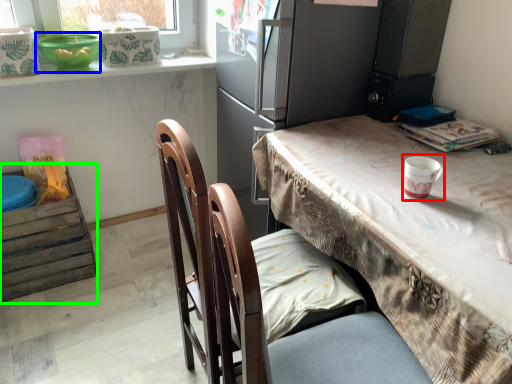
Question: Estimate the real-world distances between objects in this image. Which object is farther from paper cup (highlighted by a red box), bowl (highlighted by a blue box) or leftover (highlighted by a green box)?

Choices:
 (A) bowl
 (B) leftover

Answer: (B)